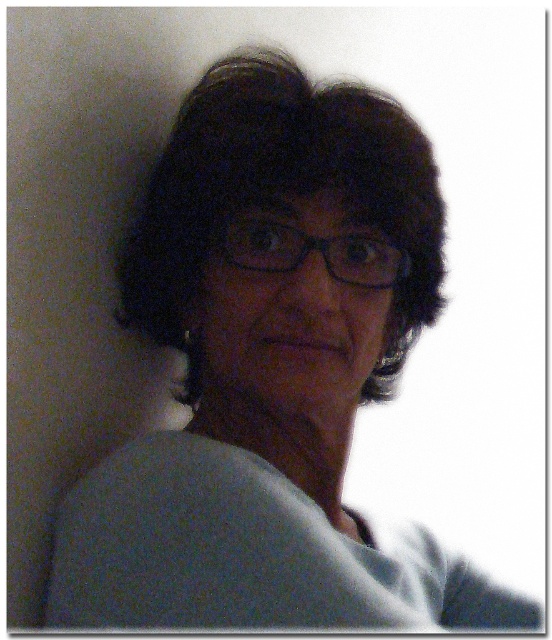
You are a photographer trying to adjust the lighting to highlight the subject. Since the dark curly hair at center and black plastic glasses at center are both in the frame, which object should you focus on to ensure proper exposure given their position?

The dark curly hair at center is located above black plastic glasses at center, so focusing on the dark curly hair at center would ensure proper exposure as it is positioned higher in the frame.

You are a photographer trying to frame a portrait. You notice the dark curly hair at center and the black plastic glasses at center in the image. Which object is wider when viewed from your camera position?

The dark curly hair at center is wider than the black plastic glasses at center.